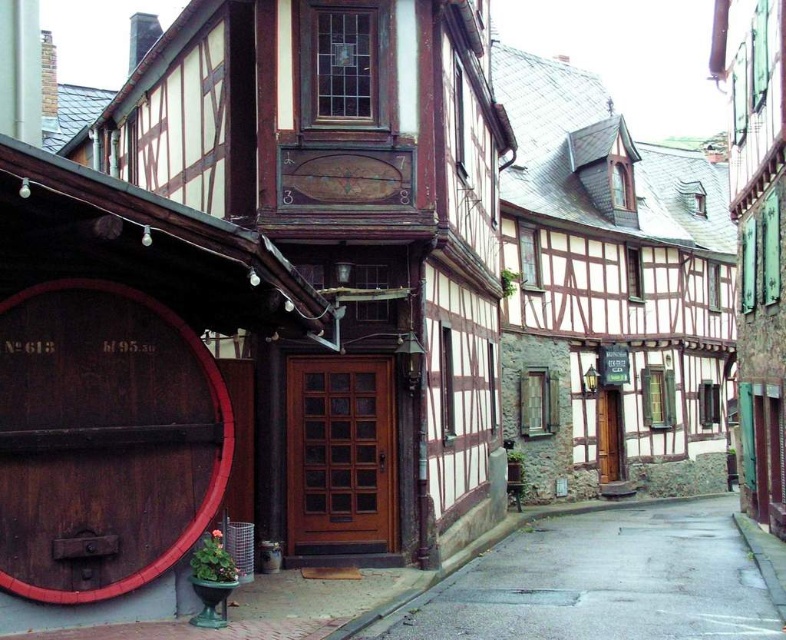
Question: Does dark brown wooden barrel at lower left have a smaller size compared to gray concrete alley at center?

Choices:
 (A) yes
 (B) no

Answer: (A)

Question: Which object is farther from the camera taking this photo?

Choices:
 (A) gray concrete alley at center
 (B) dark brown wooden barrel at lower left

Answer: (A)

Question: Is dark brown wooden barrel at lower left wider than gray concrete alley at center?

Choices:
 (A) yes
 (B) no

Answer: (B)

Question: Which object appears closest to the camera in this image?

Choices:
 (A) dark brown wooden barrel at lower left
 (B) gray concrete alley at center

Answer: (A)

Question: Does dark brown wooden barrel at lower left lie behind gray concrete alley at center?

Choices:
 (A) no
 (B) yes

Answer: (A)